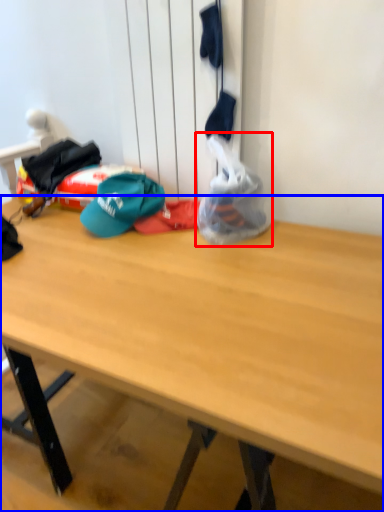
Question: Among these objects, which one is farthest to the camera, plastic bag (highlighted by a red box) or desk (highlighted by a blue box)?

Choices:
 (A) plastic bag
 (B) desk

Answer: (A)